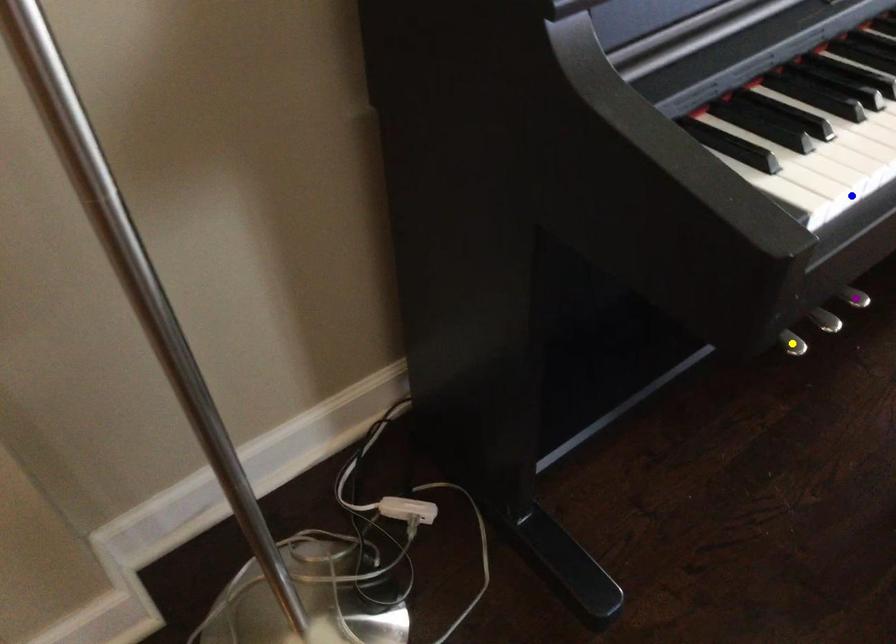
Order these from farthest to nearest:
blue point, yellow point, purple point

purple point → yellow point → blue point